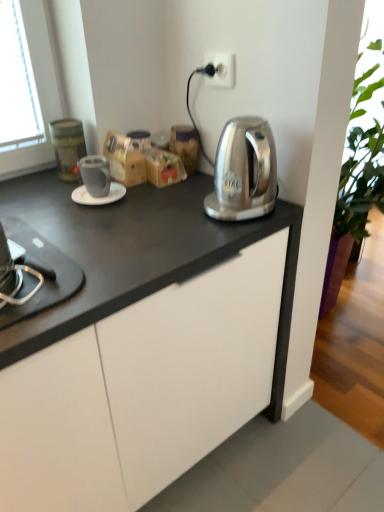
Where is `vacant space that is in between satin silver kettle at center and black glass stovetop at lower left`? Image resolution: width=384 pixels, height=512 pixels. vacant space that is in between satin silver kettle at center and black glass stovetop at lower left is located at coordinates (139, 242).